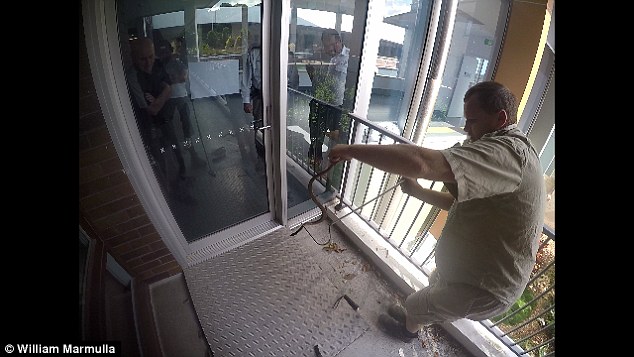
Identify the location of door handle. (267, 128).